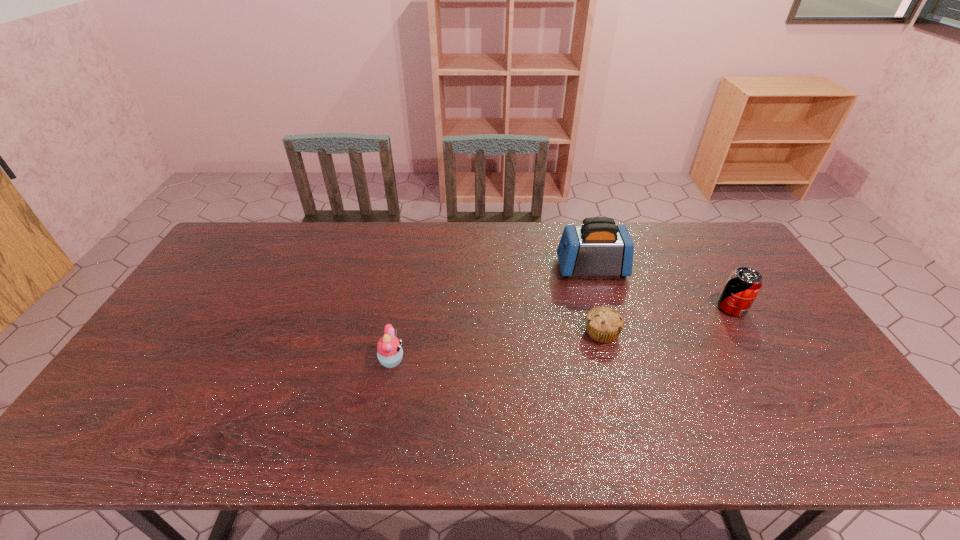
This screenshot has height=540, width=960. I want to click on object that is the third closest to the leftmost object, so [x=743, y=285].

Find the location of a particular element. This screenshot has width=960, height=540. object that is the third nearest to the third shortest object is located at coordinates (389, 351).

Identify the location of vacant area that satisfies the following two spatial constraints: 1. on the front-facing side of the farthest object; 2. on the right side of the third shortest object. (603, 308).

Where is `free space that satisfies the following two spatial constraints: 1. on the front side of the soda can; 2. on the face of the leftmost object`? The height and width of the screenshot is (540, 960). free space that satisfies the following two spatial constraints: 1. on the front side of the soda can; 2. on the face of the leftmost object is located at coordinates tap(764, 361).

This screenshot has height=540, width=960. In order to click on vacant area in the image that satisfies the following two spatial constraints: 1. on the front-facing side of the tallest object; 2. on the back side of the second farthest object in this screenshot , I will do `click(603, 308)`.